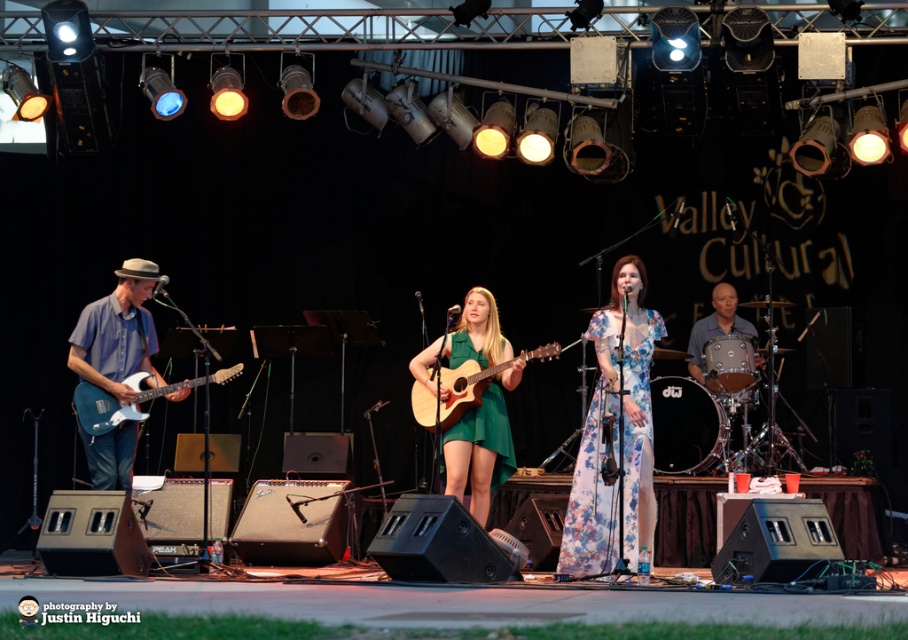
Who is taller, green matte dress at center or metallic blue electric guitar at left?

green matte dress at center is taller.

Which is behind, point (514, 468) or point (94, 422)?

The point (514, 468) is more distant.

This screenshot has width=908, height=640. In order to click on green matte dress at center in this screenshot , I will do `click(481, 445)`.

Can you confirm if blue matte electric guitar at left is bigger than natural wood acoustic guitar at center?

No, blue matte electric guitar at left is not bigger than natural wood acoustic guitar at center.

Which of these two, blue matte electric guitar at left or natural wood acoustic guitar at center, stands shorter?

natural wood acoustic guitar at center

Which is behind, point (82, 332) or point (413, 392)?

The point (413, 392) is behind.

Where is `blue matte electric guitar at left`? Image resolution: width=908 pixels, height=640 pixels. blue matte electric guitar at left is located at coordinates (117, 332).

Is floral fabric dress at center positioned before blue matte electric guitar at left?

Yes, floral fabric dress at center is in front of blue matte electric guitar at left.

Where is `floral fabric dress at center`? floral fabric dress at center is located at coordinates (622, 435).